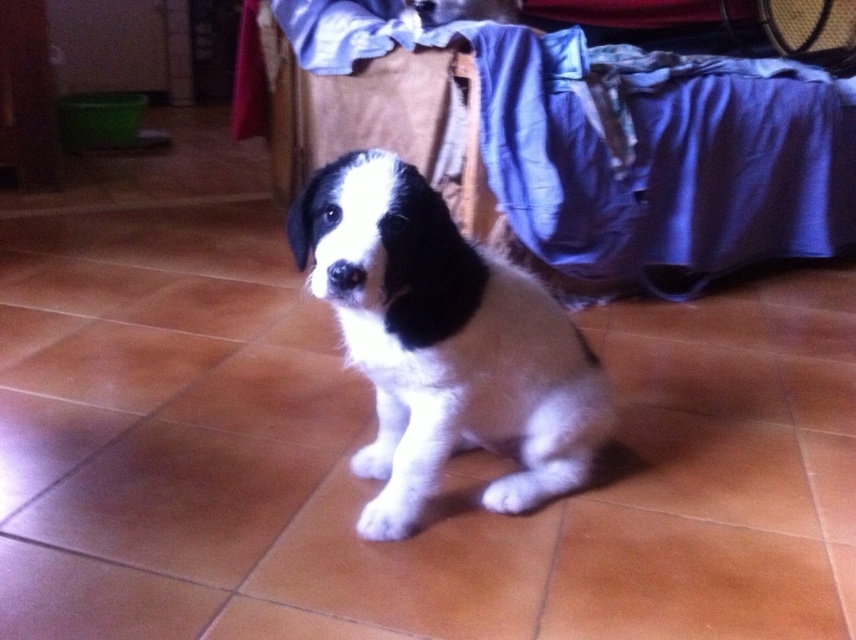
You are standing in the room and want to find the white fur dog at center. Based on the coordinates provided, where should you look relative to the furniture draped with blue fabric?

The white fur dog at center is located at coordinates approximately 0.522 on the x and 0.523 on the y axis. Since the furniture with blue fabric is part of the background, the dog is centrally positioned in the image, likely near the middle of the room between the blue furniture and other items like the green container and red cloth.